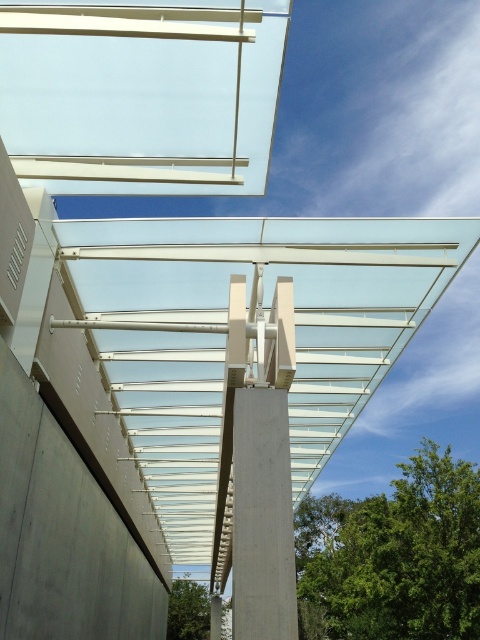
Consider the image. You are an architect designing a new building and need to ensure structural stability. Given the gray concrete wall at lower left and the concrete pillar at center, which one should you reinforce more to support the glass roof?

The gray concrete wall at lower left should be reinforced more because it has a larger size compared to the concrete pillar at center, meaning it might bear more weight and require additional support for the glass roof.

You are an architect planning to install a new light fixture. You have two options for placement locations. One is near the gray concrete wall at lower left, and the other is near the concrete pillar at center. Which location is directly below the other?

The gray concrete wall at lower left is positioned under the concrete pillar at center, so the gray concrete wall at lower left is directly below the concrete pillar at center.

You are an architect designing a new building and want to ensure the transparent glass roof at upper center and the gray concrete wall at lower left are proportionally balanced. Based on their widths, which object should be adjusted to achieve a harmonious design?

The transparent glass roof at upper center is wider than the gray concrete wall at lower left. To achieve a harmonious design, the architect should consider adjusting the width of the transparent glass roof at upper center to match or be slightly narrower than the gray concrete wall at lower left.